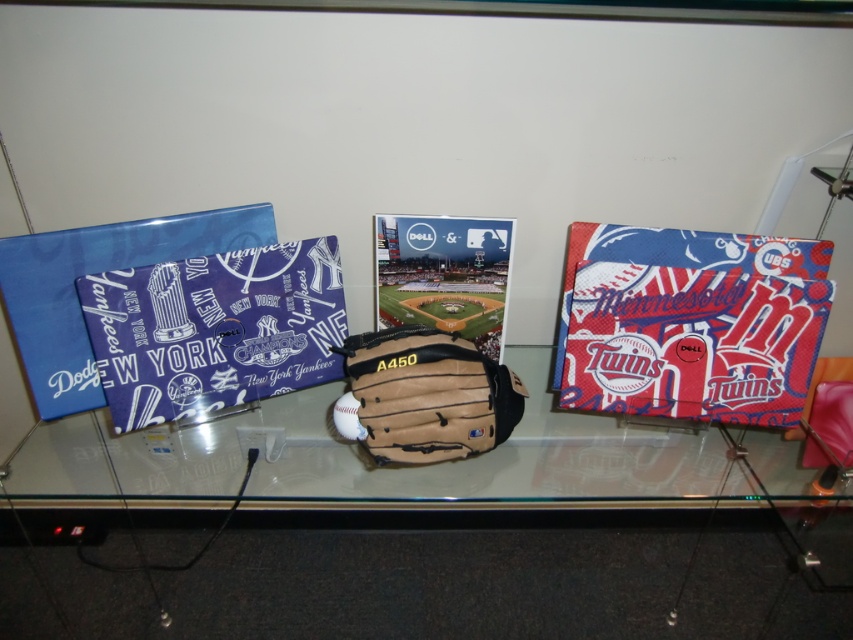
Can you confirm if transparent glass table at center is positioned below brown leather baseball glove at center?

Indeed, transparent glass table at center is positioned under brown leather baseball glove at center.

Is transparent glass table at center taller than brown leather baseball glove at center?

Yes, transparent glass table at center is taller than brown leather baseball glove at center.

Between point (277, 472) and point (485, 384), which one is positioned behind?

The point (277, 472) is behind.

Locate an element on the screen. The image size is (853, 640). transparent glass table at center is located at coordinates (428, 465).

Between transparent glass table at center and white matte baseball at center, which one is positioned lower?

transparent glass table at center

Can you confirm if transparent glass table at center is bigger than white matte baseball at center?

Indeed, transparent glass table at center has a larger size compared to white matte baseball at center.

Which is in front, point (227, 449) or point (335, 422)?

Point (335, 422)

Find the location of a particular element. transparent glass table at center is located at coordinates (428, 465).

Who is positioned more to the right, brown leather baseball glove at center or white matte baseball at center?

brown leather baseball glove at center is more to the right.

Can you confirm if brown leather baseball glove at center is positioned to the right of white matte baseball at center?

Yes, brown leather baseball glove at center is to the right of white matte baseball at center.

I want to click on brown leather baseball glove at center, so click(428, 394).

The image size is (853, 640). What are the coordinates of `brown leather baseball glove at center` in the screenshot? It's located at (428, 394).